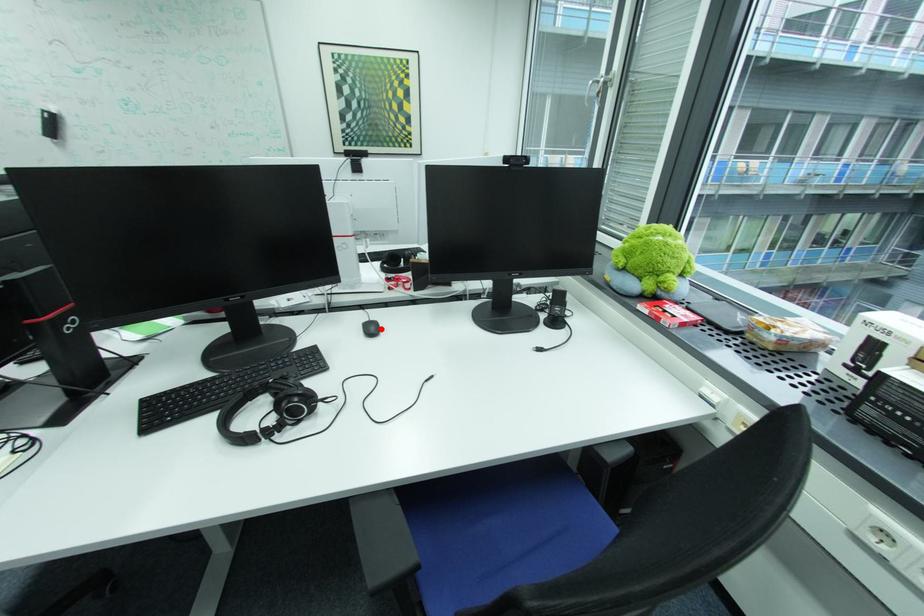
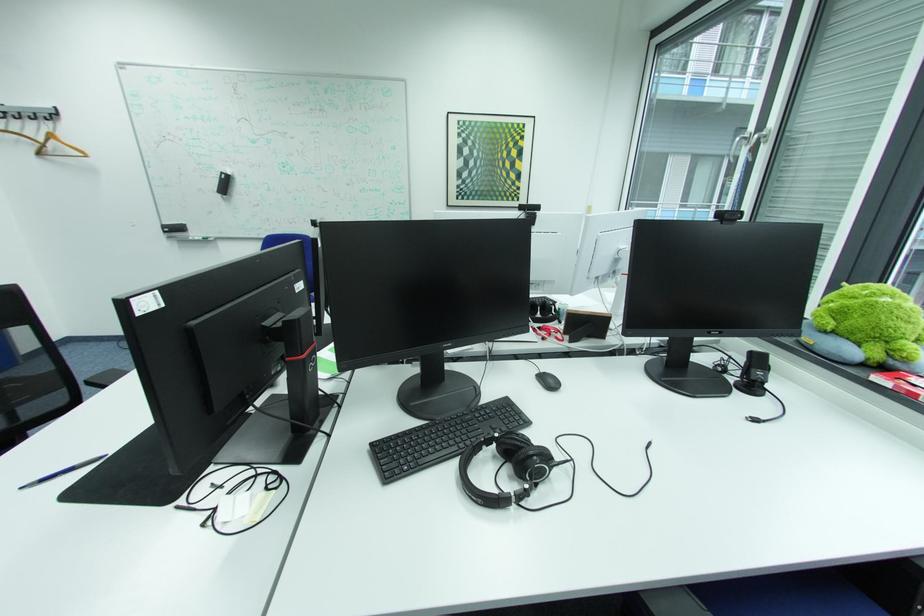
Find the pixel in the second image that matches the highlighted location in the first image.

(560, 382)